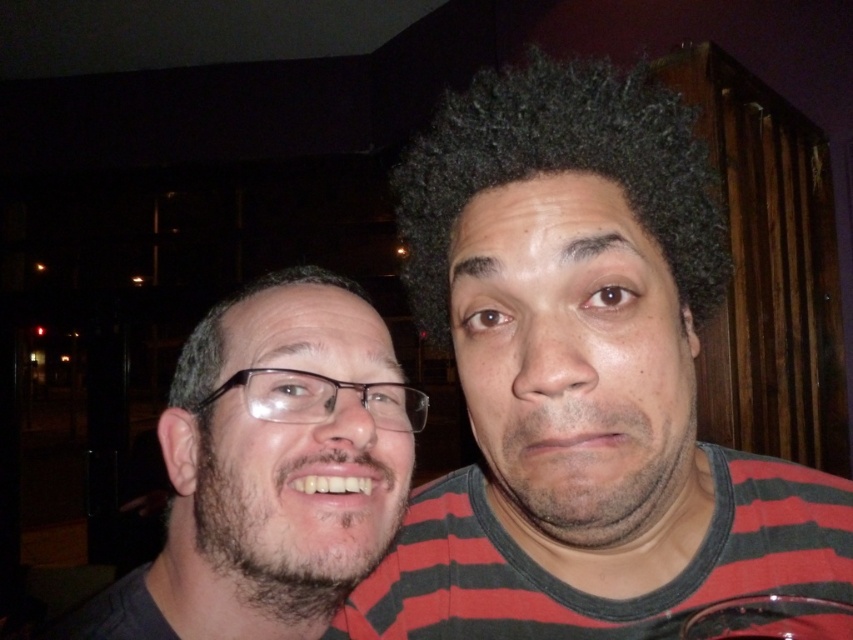
Question: Can you confirm if dark green striped shirt at right is thinner than dark curly hair at center?

Choices:
 (A) yes
 (B) no

Answer: (B)

Question: Which object is closer to the camera taking this photo?

Choices:
 (A) transparent plastic wine glass at lower right
 (B) dark green striped shirt at right
 (C) matte black glasses at left
 (D) dark curly hair at center

Answer: (B)

Question: Can you confirm if dark green striped shirt at right is positioned above matte black glasses at left?

Choices:
 (A) yes
 (B) no

Answer: (A)

Question: Which point is closer to the camera taking this photo?

Choices:
 (A) click(x=746, y=611)
 (B) click(x=445, y=198)
 (C) click(x=201, y=440)
 (D) click(x=636, y=365)

Answer: (D)

Question: Is dark green striped shirt at right further to the viewer compared to dark curly hair at center?

Choices:
 (A) no
 (B) yes

Answer: (A)

Question: Among these points, which one is farthest from the camera?

Choices:
 (A) (482, 131)
 (B) (809, 540)
 (C) (796, 608)

Answer: (B)